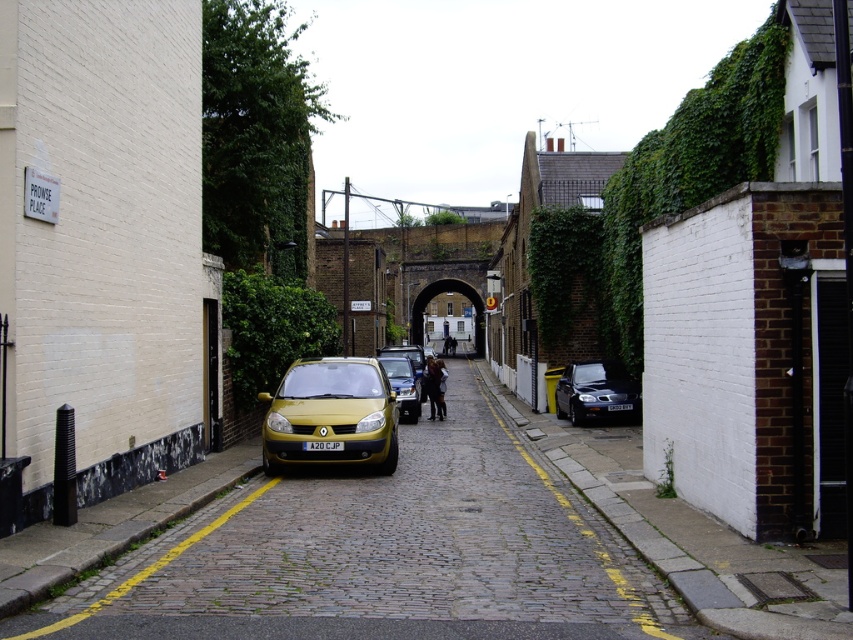
You are driving a shiny black car at center and want to exit the alley. The alley is narrow with buildings on both sides. Can you safely back up to make a U turn without hitting the metallic gold car at center?

The shiny black car at center is closer to the viewer than metallic gold car at center, so backing up might risk collision with the metallic gold car at center. Check the distance between them first.

You are a delivery person trying to park your 1.8 meters tall delivery van in this alley. You see the matte yellow car at center and the shiny black car at center. Which car is taller and could block your van from passing through?

The matte yellow car at center is taller than the shiny black car at center. Since your delivery van is 1.8 meters tall, you should check the height of the matte yellow car at center to ensure it doesn not obstruct your path.